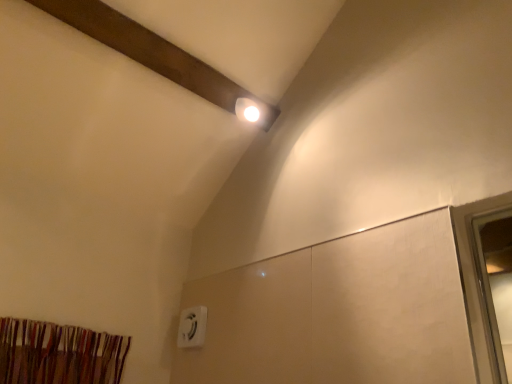
Question: Is white plastic electric outlet at lower center wider or thinner than striped fabric curtain at lower left?

Choices:
 (A) wide
 (B) thin

Answer: (B)

Question: Is point (201, 329) closer or farther from the camera than point (72, 360)?

Choices:
 (A) farther
 (B) closer

Answer: (A)

Question: Looking at the image, does white plastic electric outlet at lower center seem bigger or smaller compared to striped fabric curtain at lower left?

Choices:
 (A) big
 (B) small

Answer: (B)

Question: In terms of width, does striped fabric curtain at lower left look wider or thinner when compared to white plastic electric outlet at lower center?

Choices:
 (A) wide
 (B) thin

Answer: (A)

Question: Is striped fabric curtain at lower left taller or shorter than white plastic electric outlet at lower center?

Choices:
 (A) tall
 (B) short

Answer: (B)

Question: From the image's perspective, is striped fabric curtain at lower left positioned above or below white plastic electric outlet at lower center?

Choices:
 (A) below
 (B) above

Answer: (B)

Question: From a real-world perspective, is striped fabric curtain at lower left above or below white plastic electric outlet at lower center?

Choices:
 (A) below
 (B) above

Answer: (A)